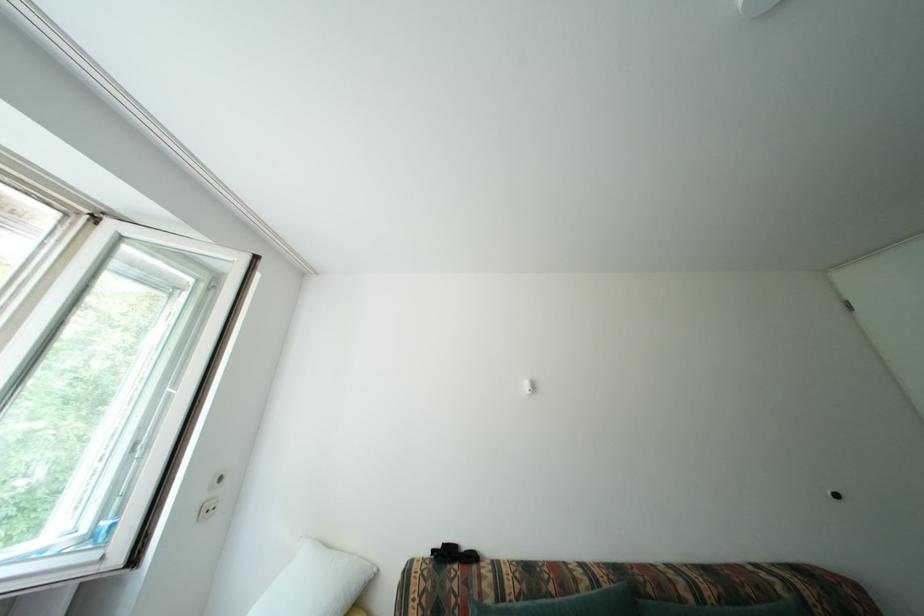
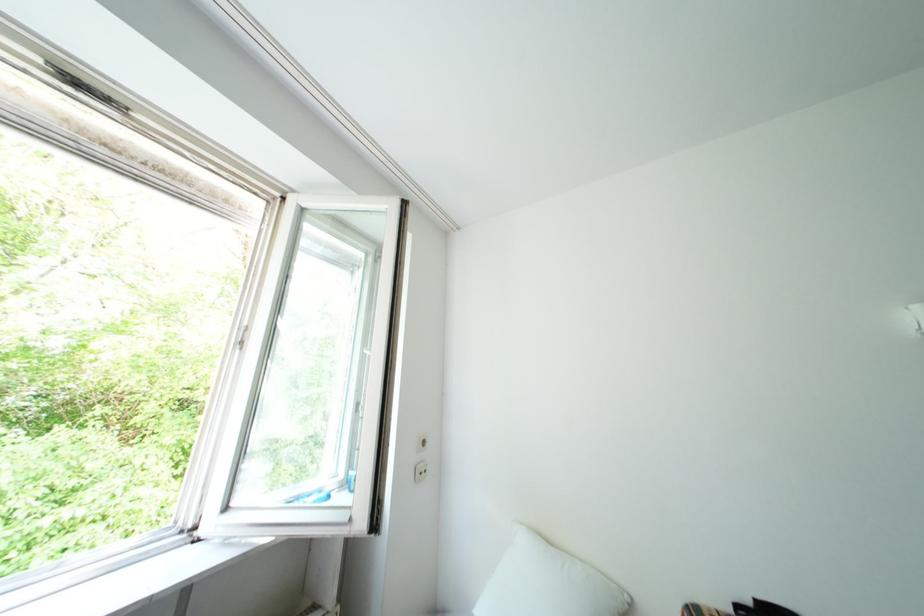
Question: The camera is either moving clockwise (left) or counter-clockwise (right) around the object. The first image is from the beginning of the video and the second image is from the end. Is the camera moving left or right when shooting the video?

Choices:
 (A) Left
 (B) Right

Answer: (B)